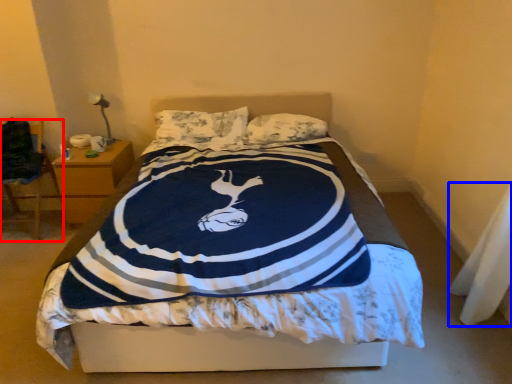
Question: Which point is further to the camera, chair (highlighted by a red box) or material (highlighted by a blue box)?

Choices:
 (A) chair
 (B) material

Answer: (A)